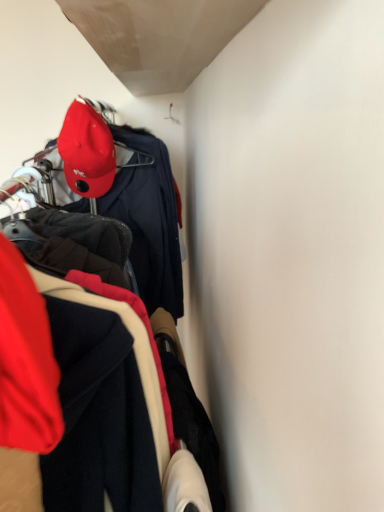
What do you see at coordinates (87, 150) in the screenshot?
I see `matte red cap at upper left` at bounding box center [87, 150].

Where is `matte red cap at upper left`? matte red cap at upper left is located at coordinates (87, 150).

Locate an element on the screen. This screenshot has width=384, height=512. matte red cap at upper left is located at coordinates (87, 150).